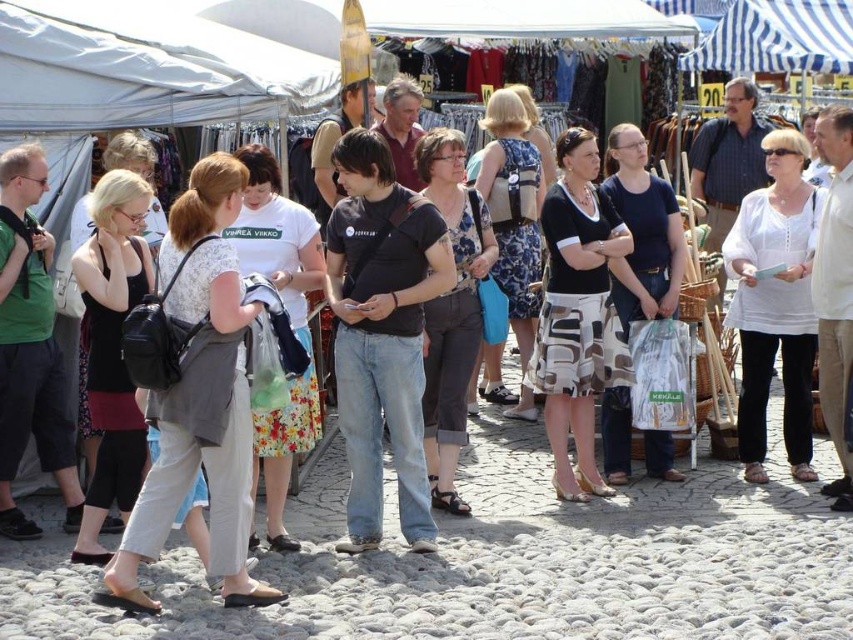
You are a customer at the market and want to buy both the white cotton blouse at center and the patterned fabric skirt at center. Which item is positioned to the right of the other?

The white cotton blouse at center is to the right of the patterned fabric skirt at center.

You are standing in the middle of the cobblestone street at the lively outdoor market. You notice two points marked in the scene. One is at coordinate point (350, 547) and the other at point (572, 156). Which of these two points is nearer to your current position?

Point (350, 547) is closer to the camera than point (572, 156), so the point at (350, 547) is nearer to your current position.

You are a customer at the market and want to buy both the white cotton blouse at center and the patterned fabric skirt at center. When hanging them side by side on a rack, which one will appear taller?

The white cotton blouse at center is taller than the patterned fabric skirt at center, so it will appear taller when hung side by side on a rack.